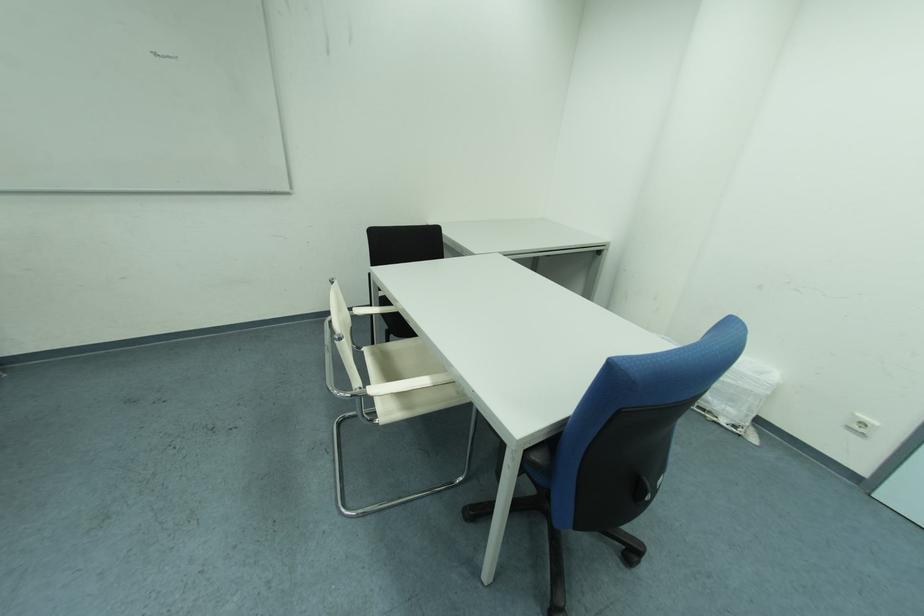
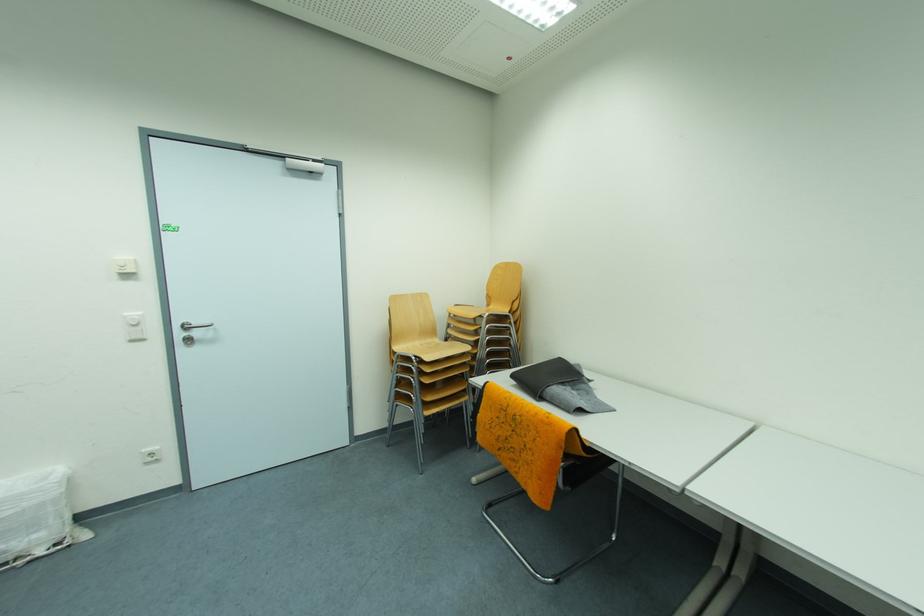
Question: The camera is either moving clockwise (left) or counter-clockwise (right) around the object. The first image is from the beginning of the video and the second image is from the end. Is the camera moving left or right when shooting the video?

Choices:
 (A) Left
 (B) Right

Answer: (A)